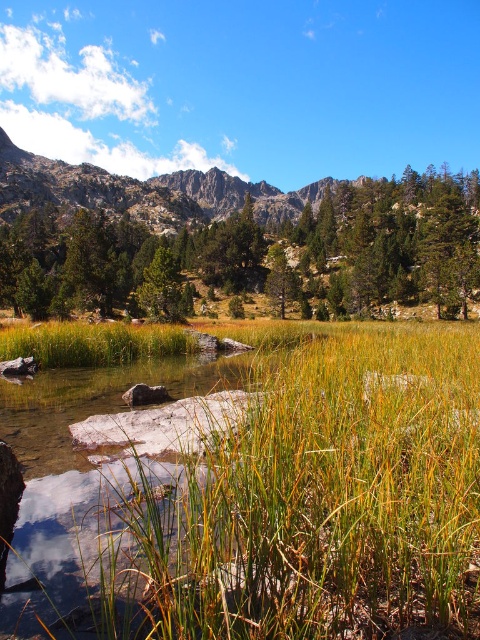
At what (x,y) coordinates should I click in order to perform the action: click on green matte tree at upper center. Please return your answer as a coordinate pair (x, y). The height and width of the screenshot is (640, 480). Looking at the image, I should click on click(x=235, y=241).

Based on the photo, who is positioned more to the left, green matte tree at upper center or green matte tree at center?

Positioned to the left is green matte tree at upper center.

Is point (172, 244) farther from viewer compared to point (188, 284)?

Yes, point (172, 244) is farther from viewer.

I want to click on green matte tree at upper center, so click(x=235, y=241).

In the scene shown: Between green matte tree at upper center and rugged granite mountain at upper left, which one has less height?

rugged granite mountain at upper left

Between point (467, 220) and point (144, 202), which one is positioned in front?

Point (467, 220) is in front.

The height and width of the screenshot is (640, 480). What do you see at coordinates (235, 241) in the screenshot?
I see `green matte tree at upper center` at bounding box center [235, 241].

Where is `green matte tree at upper center`? The height and width of the screenshot is (640, 480). green matte tree at upper center is located at coordinates (235, 241).

Is green grass at center smaller than rugged granite mountain at upper left?

Yes, green grass at center is smaller than rugged granite mountain at upper left.

Which is behind, point (478, 456) or point (64, 188)?

Point (64, 188)

This screenshot has width=480, height=640. Identify the location of green grass at center. (257, 497).